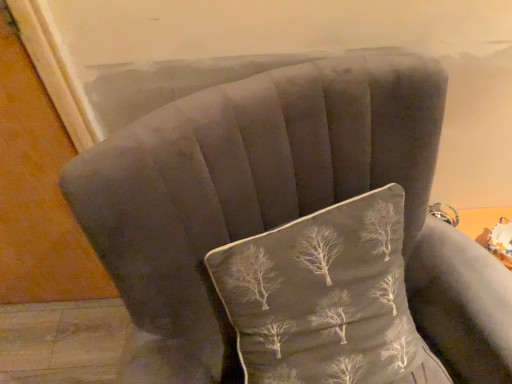
This screenshot has height=384, width=512. What are the coordinates of `velvet gray pillow with tree pattern at center` in the screenshot? It's located at [326, 299].

What do you see at coordinates (326, 299) in the screenshot? This screenshot has width=512, height=384. I see `velvet gray pillow with tree pattern at center` at bounding box center [326, 299].

Measure the distance between velvet gray pillow with tree pattern at center and camera.

The depth of velvet gray pillow with tree pattern at center is 26.42 inches.

Find the location of a particular element. velvet gray pillow with tree pattern at center is located at coordinates (326, 299).